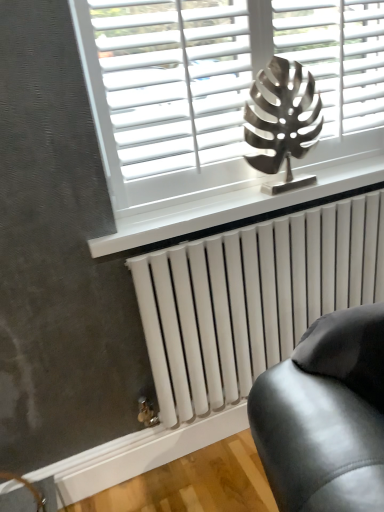
Find the location of a particular element. Image resolution: width=384 pixels, height=512 pixels. free point above white glossy radiator at lower center (from a real-world perspective) is located at coordinates (232, 196).